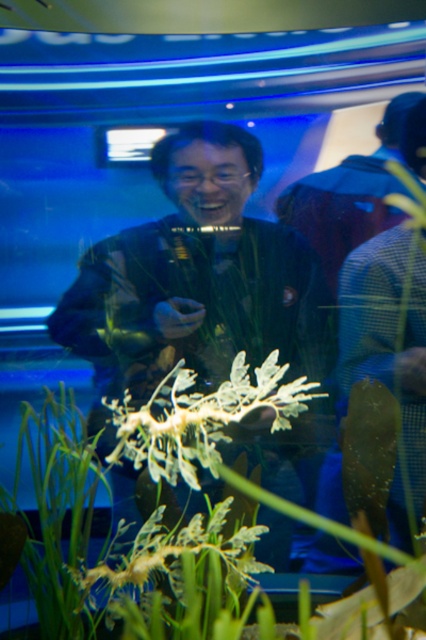
Question: Can you confirm if white leafy plant at center is thinner than white leafy structure at center?

Choices:
 (A) yes
 (B) no

Answer: (B)

Question: Which point is farther from the camera taking this photo?

Choices:
 (A) (207, 416)
 (B) (236, 541)

Answer: (A)

Question: Does white leafy plant at center have a smaller size compared to white leafy structure at center?

Choices:
 (A) no
 (B) yes

Answer: (A)

Question: Is white leafy plant at center below white leafy structure at center?

Choices:
 (A) yes
 (B) no

Answer: (A)

Question: Among these objects, which one is nearest to the camera?

Choices:
 (A) white leafy structure at center
 (B) white leafy plant at center

Answer: (B)